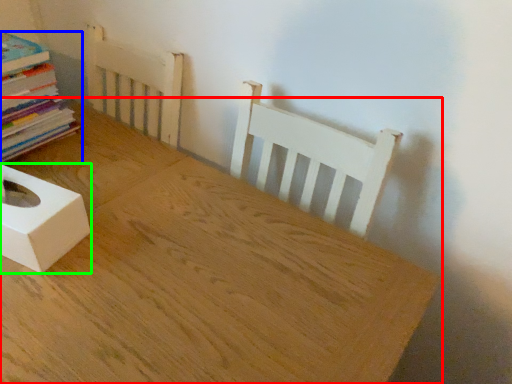
Question: Based on their relative distances, which object is farther from table (highlighted by a red box)? Choose from book (highlighted by a blue box) and box (highlighted by a green box).

Choices:
 (A) book
 (B) box

Answer: (A)